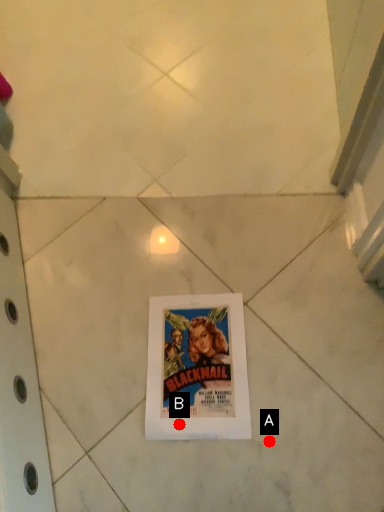
Question: Two points are circled on the image, labeled by A and B beside each circle. Which point appears farthest from the camera in this image?

Choices:
 (A) A is further
 (B) B is further

Answer: (B)